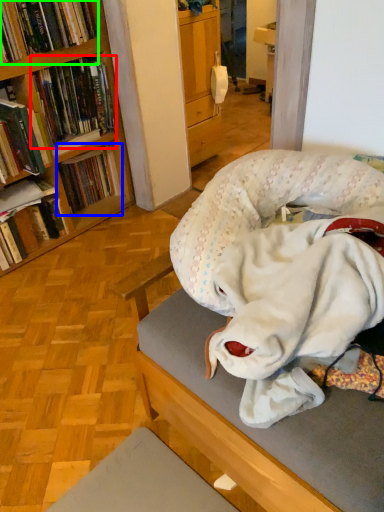
Question: Which object is positioned farthest from book (highlighted by a red box)? Select from book (highlighted by a blue box) and book (highlighted by a green box).

Choices:
 (A) book
 (B) book

Answer: (A)